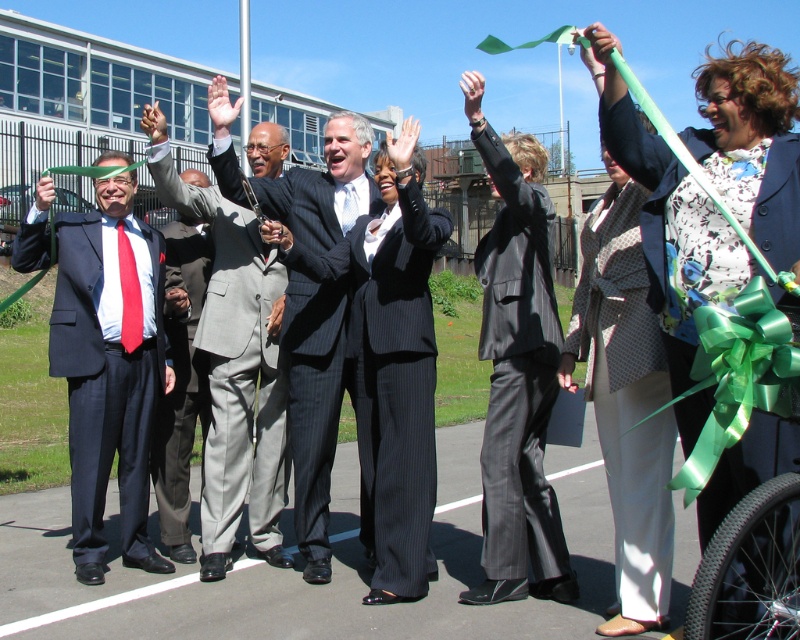
Who is more forward, [409,504] or [264,209]?

Point [409,504]

Is black pinstripe suit at center further to the viewer compared to gray suit at center?

No, it is in front of gray suit at center.

The width and height of the screenshot is (800, 640). Find the location of `black pinstripe suit at center`. black pinstripe suit at center is located at coordinates (392, 381).

Is black leather suit at center bigger than light gray suit at center?

No, black leather suit at center is not bigger than light gray suit at center.

Is point (484, 454) positioned behind point (218, 433)?

No, it is in front of (218, 433).

You are a GUI agent. You are given a task and a screenshot of the screen. Output one action in this format:
    pyautogui.click(x=<x>, y=<y>)
    Task: Click on the black leather suit at center
    The width and height of the screenshot is (800, 640).
    Given the screenshot: What is the action you would take?
    click(518, 378)

Can you confirm if black pinstripe suit at center is wider than gray wool suit at center?

Indeed, black pinstripe suit at center has a greater width compared to gray wool suit at center.

Does black pinstripe suit at center have a lesser height compared to gray wool suit at center?

Incorrect, black pinstripe suit at center's height does not fall short of gray wool suit at center's.

The width and height of the screenshot is (800, 640). What do you see at coordinates (392, 381) in the screenshot?
I see `black pinstripe suit at center` at bounding box center [392, 381].

I want to click on black pinstripe suit at center, so click(x=392, y=381).